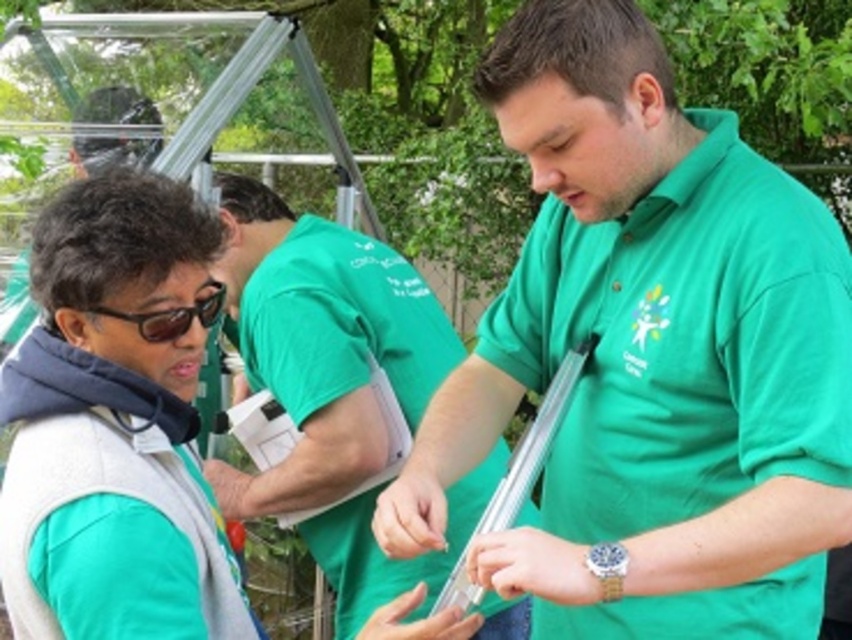
You are a photographer trying to capture a clear shot of both the green fabric shirt at center and the black plastic goggles at upper left. Based on their positions, which object should you focus on first to ensure both are in focus?

The green fabric shirt at center is below the black plastic goggles at upper left, so focusing on the black plastic goggles at upper left first will help ensure both are in focus as the shirt is lower in the frame.

You are navigating through the park and see two points marked in the image. Which point is closer to you, point (469, 387) or point (186, 314)?

Point (186, 314) is closer to you because point (469, 387) is behind it.